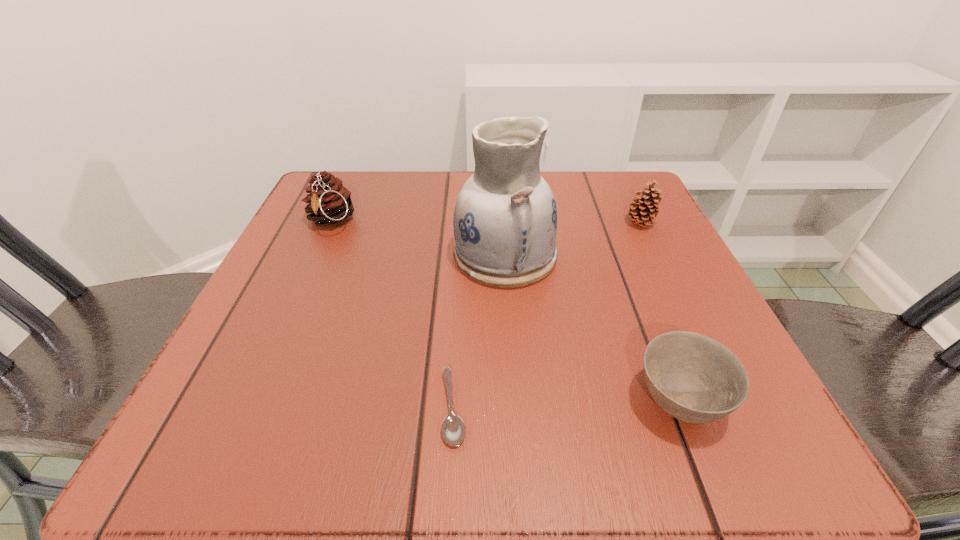
Find the location of a particular element. This screenshot has width=960, height=540. free location that satisfies the following two spatial constraints: 1. with a leaf charm attached to the leftmost object; 2. on the left side of the tallest object is located at coordinates (316, 254).

I want to click on free location that satisfies the following two spatial constraints: 1. with a leaf charm attached to the shortest object; 2. on the right side of the leftmost object, so [246, 408].